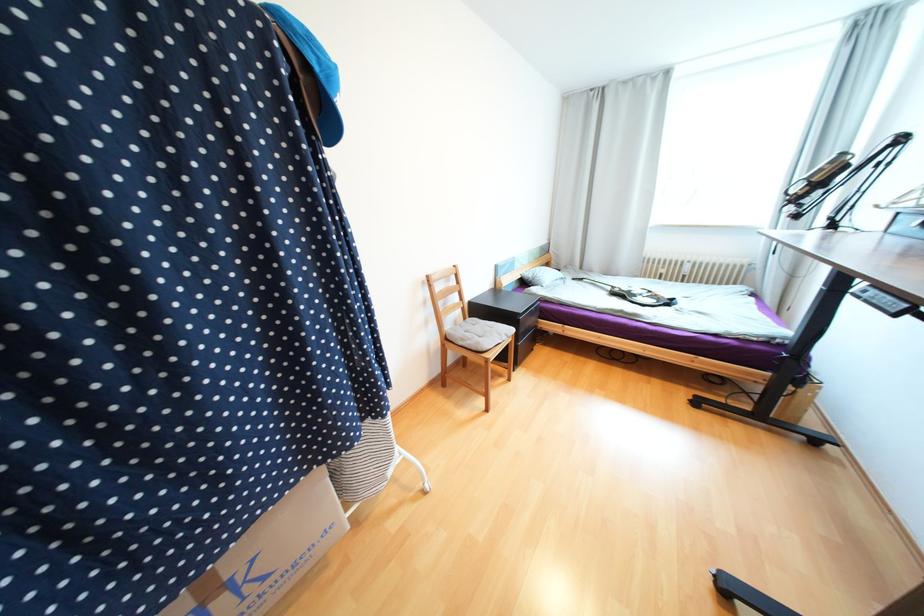
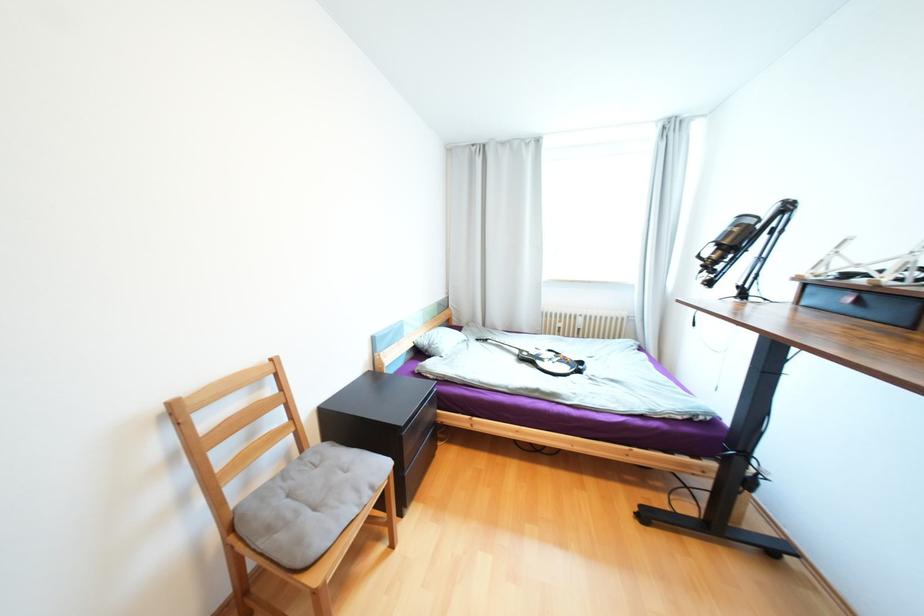
Which direction would the cameraman need to move to produce the second image?

The cameraman moved toward right, forward.